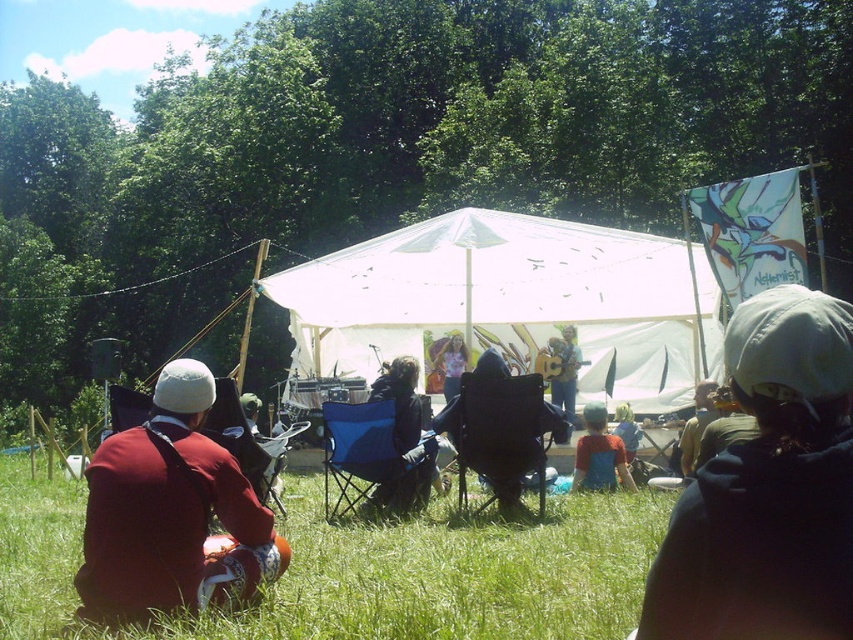
You are planning to set up a small booth for merchandise sales. You have a booth that is 2 meters wide. You need to place it in the scene so that it doesn not block the view of the stage for the attendees. Which area between the green grassy field at lower center and the blue fabric shirt at center would be more suitable for placing the booth without obstructing the view?

The green grassy field at lower center is wider than the blue fabric shirt at center, so placing the booth in the green grassy field at lower center would provide enough space and avoid blocking the stage view for attendees.

You are a photographer at the music festival trying to capture a clear shot of both the black fabric chair at center and the blue denim shirt at center. Since you want both subjects to be in focus, you need to adjust your camera settings. Which object should you focus on first to ensure both are sharp in the photo?

You should focus on the black fabric chair at center first because it is closer to the viewer than the blue denim shirt at center. By focusing on the closer object, the farther one will also be in focus due to the depth of field.